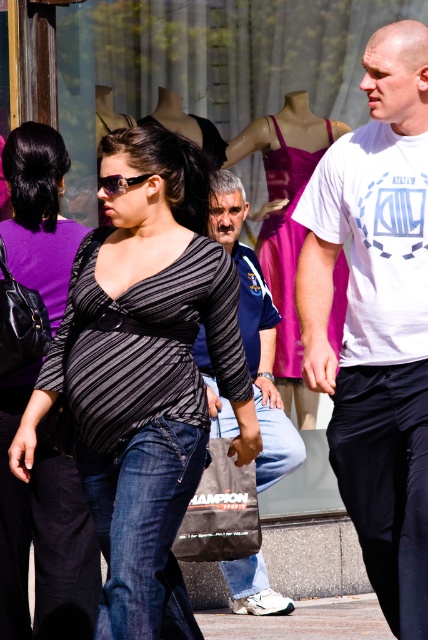
Is striped fabric dress at center below shiny black sunglasses at center?

Yes, striped fabric dress at center is below shiny black sunglasses at center.

Is striped fabric dress at center shorter than shiny black sunglasses at center?

Incorrect, striped fabric dress at center's height does not fall short of shiny black sunglasses at center's.

Which is in front, point (300, 246) or point (119, 182)?

Point (119, 182) is in front.

The width and height of the screenshot is (428, 640). In order to click on striped fabric dress at center in this screenshot , I will do `click(285, 225)`.

The width and height of the screenshot is (428, 640). I want to click on white cotton t-shirt at center, so click(377, 320).

Does point (386, 547) lie in front of point (169, 499)?

No, it is not.

Which is in front, point (368, 561) or point (157, 460)?

Point (157, 460)

Locate an element on the screen. white cotton t-shirt at center is located at coordinates (377, 320).

Looking at this image, does striped fabric shirt at center have a lesser width compared to striped jersey at center?

In fact, striped fabric shirt at center might be wider than striped jersey at center.

Which is more to the left, striped fabric shirt at center or striped jersey at center?

striped jersey at center

Is point (228, 292) positioned after point (80, 552)?

That is False.

I want to click on striped fabric shirt at center, so click(145, 376).